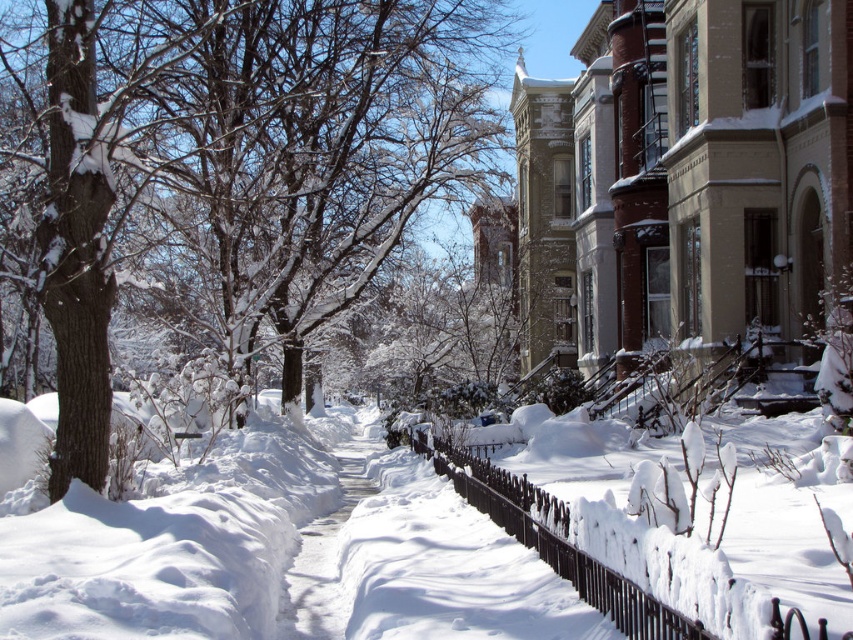
In the scene shown: You are standing in the winter scene and want to walk from the black wrought iron fence at center to the white fluffy snow at center. Which direction should you face to walk directly towards it?

You should face to the right because the white fluffy snow at center is located to the right of the black wrought iron fence at center.